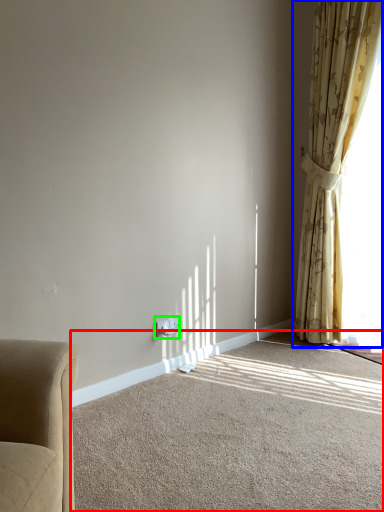
Question: Which is nearer to the plain (highlighted by a red box)? curtain (highlighted by a blue box) or electric outlet (highlighted by a green box).

Choices:
 (A) curtain
 (B) electric outlet

Answer: (B)